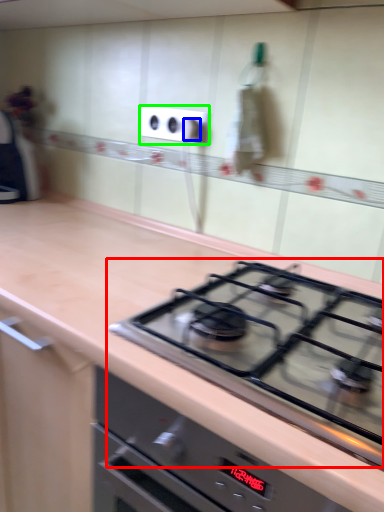
Question: Estimate the real-world distances between objects in this image. Which object is farther from gas stove (highlighted by a red box), knob (highlighted by a blue box) or electric outlet (highlighted by a green box)?

Choices:
 (A) knob
 (B) electric outlet

Answer: (A)